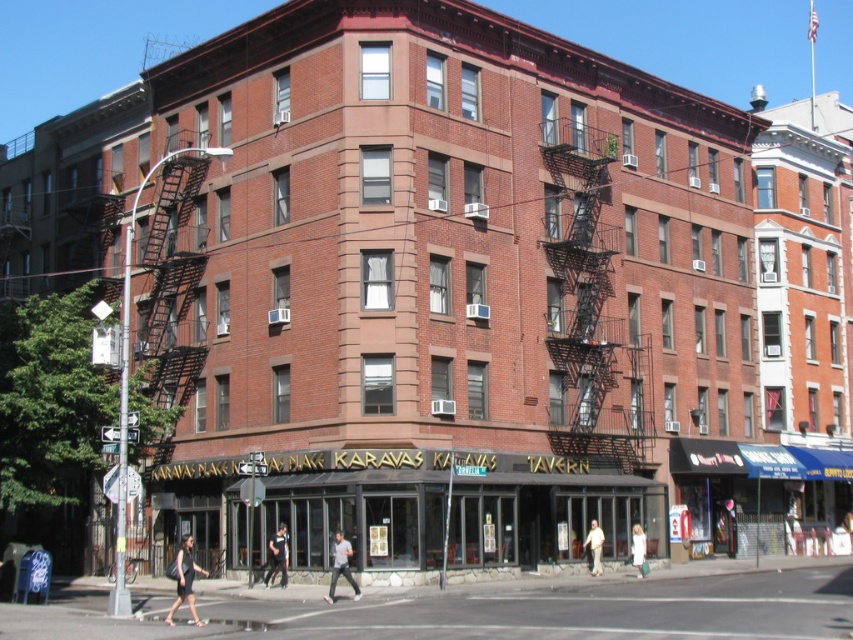
You are a customer entering Karavas Tavern and see a black dress at center and a white cotton shirt at center. Which clothing item is positioned to the left?

The black dress at center is positioned to the left of the white cotton shirt at center.